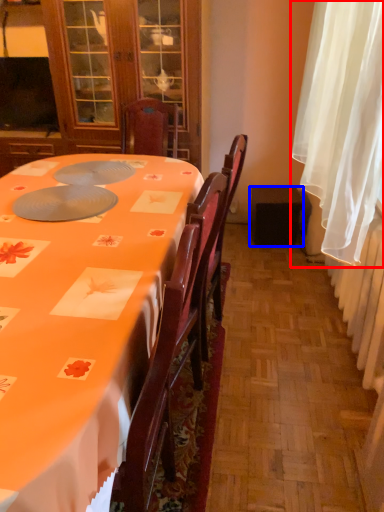
Question: Which point is further to the camera, curtain (highlighted by a red box) or loudspeaker (highlighted by a blue box)?

Choices:
 (A) curtain
 (B) loudspeaker

Answer: (B)